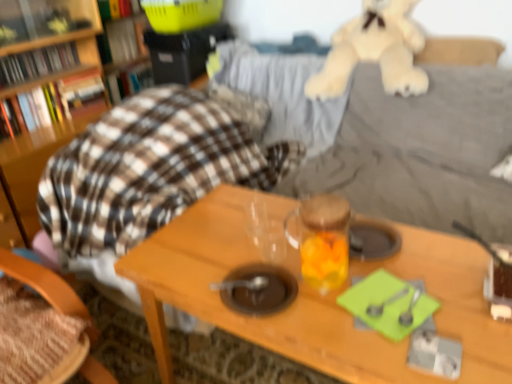
Question: Is soft beige plush at upper right bigger or smaller than transparent glass jar at center?

Choices:
 (A) small
 (B) big

Answer: (B)

Question: Considering the relative positions of soft beige plush at upper right and transparent glass jar at center in the image provided, is soft beige plush at upper right to the left or to the right of transparent glass jar at center?

Choices:
 (A) right
 (B) left

Answer: (A)

Question: Estimate the real-world distances between objects in this image. Which object is closer to the hardcover book at upper left, which is the sixth book from bottom to top?

Choices:
 (A) soft beige plush at upper right
 (B) hardcover book at left, which is the 1th book in bottom-to-top order
 (C) wooden table at center
 (D) matte black bookshelf at upper left, the 4th book viewed from the top
 (E) hardcover book at upper left, positioned as the third book in top-to-bottom order

Answer: (E)

Question: Estimate the real-world distances between objects in this image. Which object is farther from the transparent glass jar at center?

Choices:
 (A) wooden chair at left
 (B) hardcover book at left, which appears as the 6th book when viewed from the top
 (C) matte black bookshelf at upper left, the 4th book viewed from the top
 (D) hardcover book at upper left, which is the sixth book from bottom to top
 (E) wooden table at center

Answer: (D)